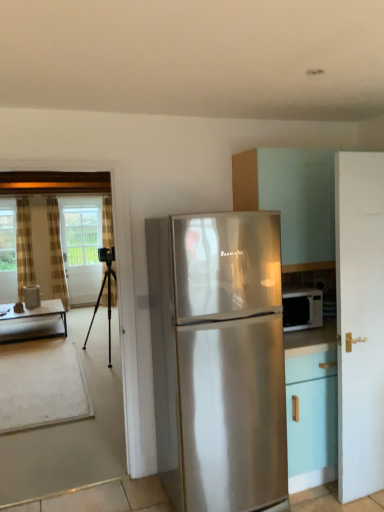
Find the location of a particular element. vacant space in white matte door at right (from a real-world perspective) is located at coordinates (364, 494).